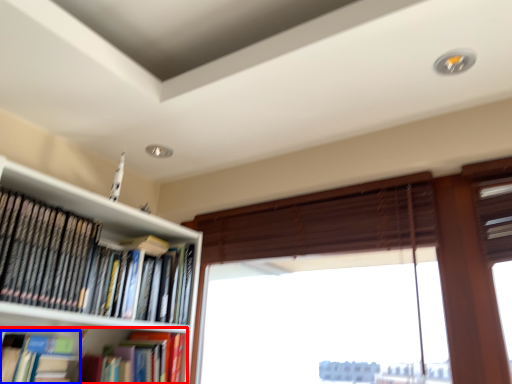
Question: Among these objects, which one is nearest to the camera, book (highlighted by a red box) or book (highlighted by a blue box)?

Choices:
 (A) book
 (B) book

Answer: (B)